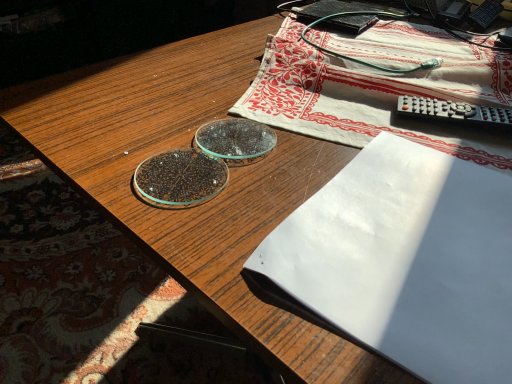
This screenshot has width=512, height=384. Find the location of `unoccupied space behind white paper at center`. unoccupied space behind white paper at center is located at coordinates (367, 111).